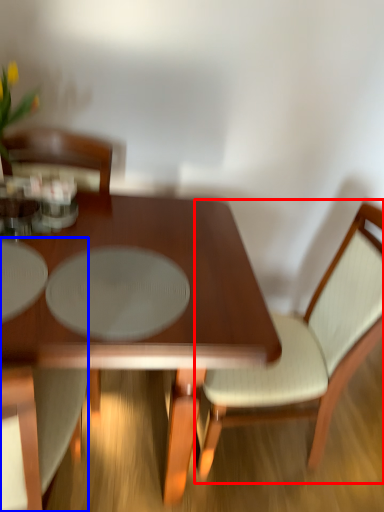
Question: Among these objects, which one is nearest to the camera, chair (highlighted by a red box) or chair (highlighted by a blue box)?

Choices:
 (A) chair
 (B) chair

Answer: (B)